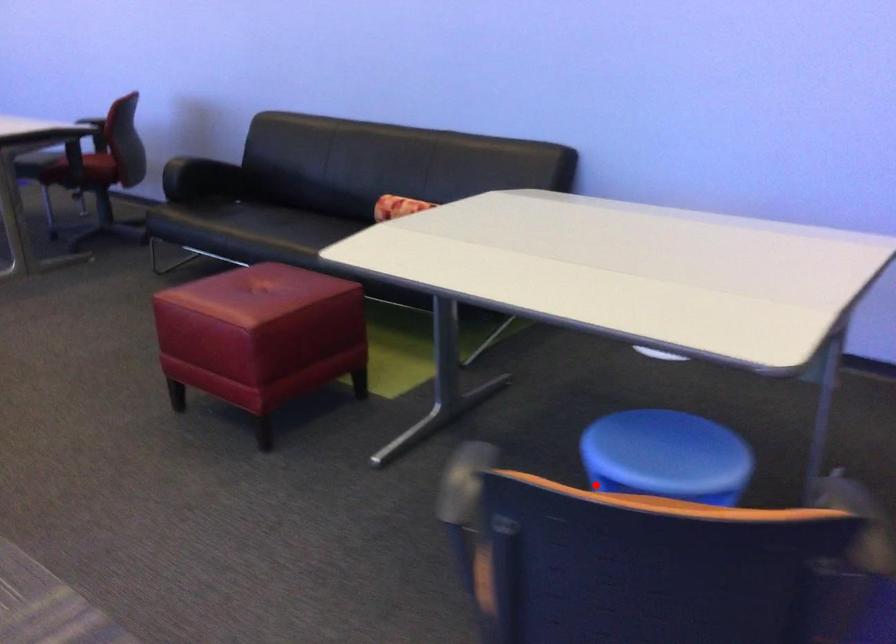
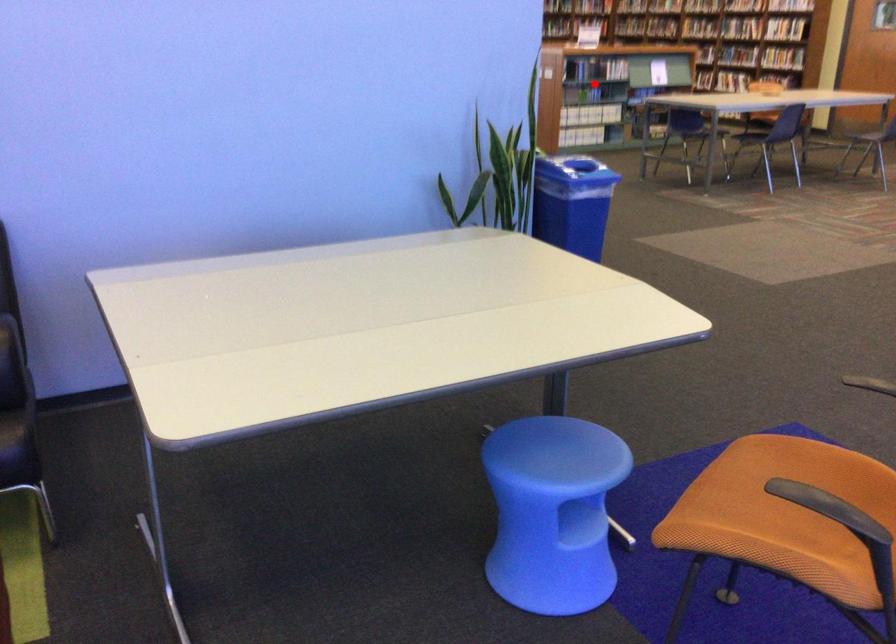
I am providing you with two images of the same scene from different viewpoints. A red point is marked on the first image and another point is marked on the second image. Are the points marked in image1 and image2 representing the same 3D position?

No